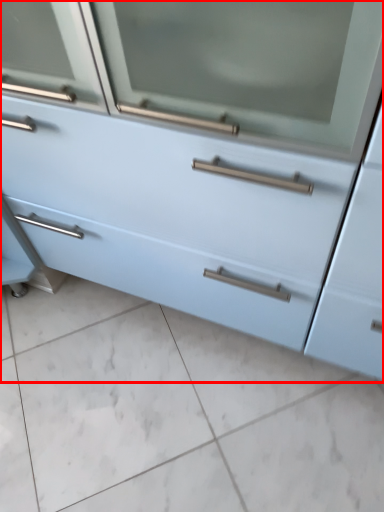
Question: In this image, where is chest of drawers (annotated by the red box) located relative to ceramic tile?

Choices:
 (A) right
 (B) left

Answer: (A)